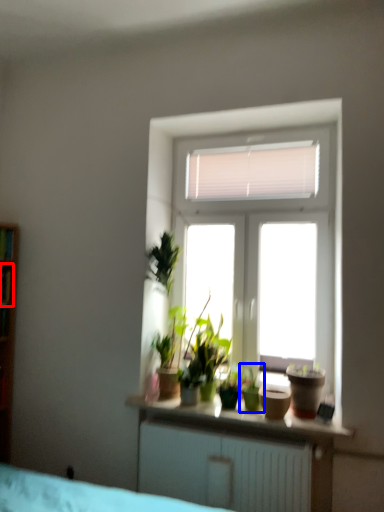
Question: Which object appears closest to the camera in this image, window (highlighted by a red box) or houseplant (highlighted by a blue box)?

Choices:
 (A) window
 (B) houseplant

Answer: (B)